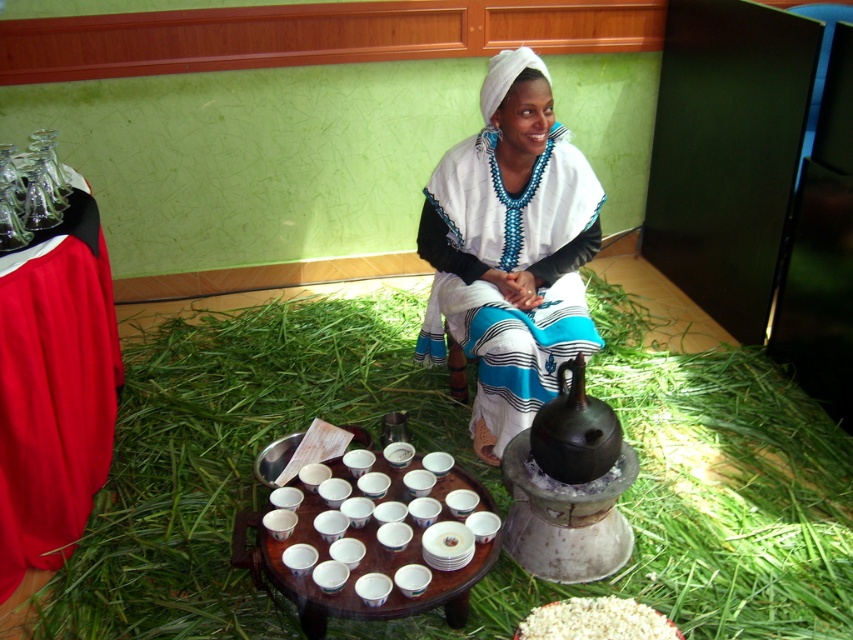
You are a guest at this traditional gathering and need to place a small gift on the largest available surface. Which object between the green grassy hay at center and the wooden table at center should you choose?

The green grassy hay at center is larger in size than the wooden table at center, so you should place the small gift on the green grassy hay at center.

You are a guest at this traditional gathering and need to place your bag on a surface. Which object, the smooth red fabric at left or the wooden table at center, would be more suitable for placing your bag based on their heights?

The smooth red fabric at left has a greater height compared to the wooden table at center, so placing your bag on the smooth red fabric at left would be more suitable as it is higher and likely more stable.

You are a visitor at this traditional setting and want to sit down at the wooden table at center. Which direction should you walk to reach it from your current position, considering the green grassy hay at center is in the way?

The wooden table at center is behind the green grassy hay at center, so you should walk around or move the green grassy hay at center to reach the wooden table at center.